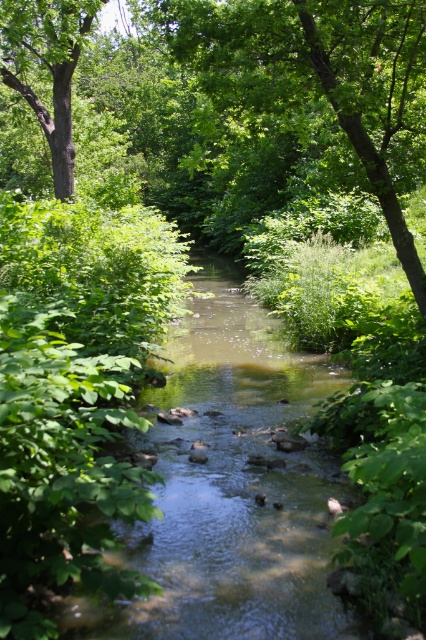
You are a hiker standing at the edge of the stream and see the green leafy tree at center and the brown rough tree at left. Which tree is closer to the stream?

The green leafy tree at center is closer to the stream because it is positioned below the brown rough tree at left, meaning it is situated lower in the scene and nearer to the stream.